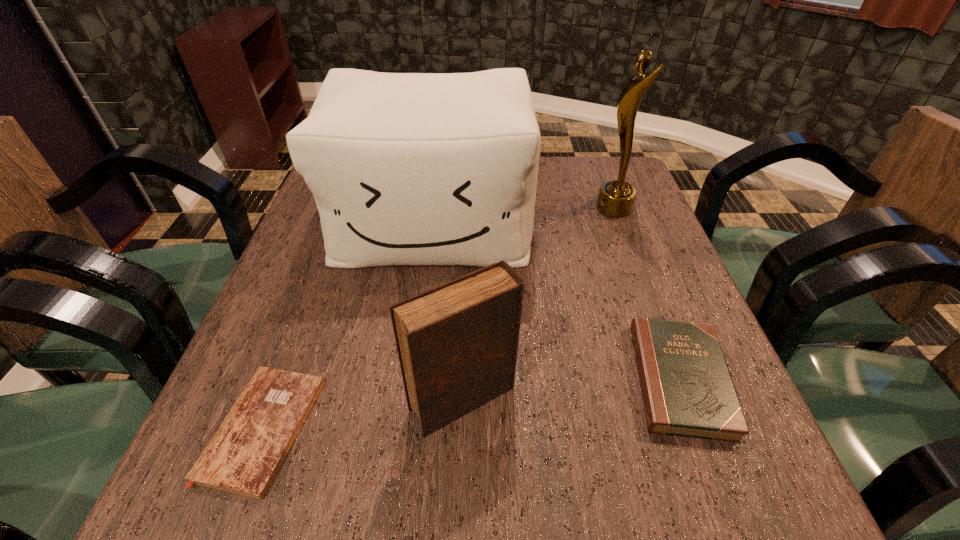
Choose which Bible is the nearest neighbor to the cushion. Please provide its 2D coordinates. Your answer should be formatted as a tuple, i.e. [(x, y)], where the tuple contains the x and y coordinates of a point satisfying the conditions above.

[(687, 390)]

You are a GUI agent. You are given a task and a screenshot of the screen. Output one action in this format:
    pyautogui.click(x=<x>, y=<y>)
    Task: Click on the vacant region that satisfies the following two spatial constraints: 1. on the side of the tallest Bible with the smiley face; 2. on the left side of the cushion
    Image resolution: width=960 pixels, height=540 pixels.
    Given the screenshot: What is the action you would take?
    pyautogui.click(x=410, y=399)

The height and width of the screenshot is (540, 960). Identify the location of free spot that satisfies the following two spatial constraints: 1. on the front-facing side of the award; 2. on the side of the cushion with the smiley face. (620, 224).

Image resolution: width=960 pixels, height=540 pixels. Find the location of `free location that satisfies the following two spatial constraints: 1. on the front-facing side of the award; 2. on the right side of the fourth tallest object`. free location that satisfies the following two spatial constraints: 1. on the front-facing side of the award; 2. on the right side of the fourth tallest object is located at coordinates (679, 379).

The width and height of the screenshot is (960, 540). What are the coordinates of `free space that satisfies the following two spatial constraints: 1. on the front-facing side of the award; 2. on the side of the cushion with the smiley face` in the screenshot? It's located at (x=620, y=224).

Identify the location of blank area in the image that satisfies the following two spatial constraints: 1. on the side of the cushion with the smiley face; 2. on the left side of the second shortest Bible. The height and width of the screenshot is (540, 960). (413, 379).

Identify the location of free space in the image that satisfies the following two spatial constraints: 1. on the front-facing side of the award; 2. on the back side of the fourth tallest object. This screenshot has width=960, height=540. (679, 379).

You are a GUI agent. You are given a task and a screenshot of the screen. Output one action in this format:
    pyautogui.click(x=<x>, y=<y>)
    Task: Click on the free space that satisfies the following two spatial constraints: 1. on the front-facing side of the award; 2. on the side of the cushion with the smiley face
    
    Given the screenshot: What is the action you would take?
    pyautogui.click(x=620, y=224)

Image resolution: width=960 pixels, height=540 pixels. Find the location of `free space in the image that satisfies the following two spatial constraints: 1. on the front-facing side of the award; 2. on the side of the cushion with the smiley face`. free space in the image that satisfies the following two spatial constraints: 1. on the front-facing side of the award; 2. on the side of the cushion with the smiley face is located at coordinates (620, 224).

Where is `vacant point that satisfies the following two spatial constraints: 1. on the side of the fourth tallest object with the smiley face; 2. on the left side of the cushion`? vacant point that satisfies the following two spatial constraints: 1. on the side of the fourth tallest object with the smiley face; 2. on the left side of the cushion is located at coordinates (413, 379).